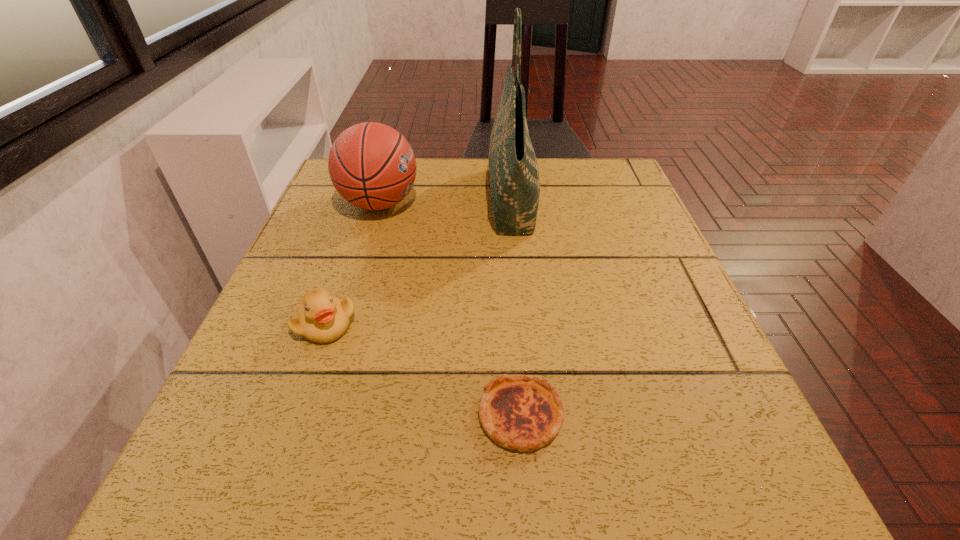
What are the coordinates of `vacant area at the near left corner` in the screenshot? It's located at (252, 518).

This screenshot has width=960, height=540. Find the location of `vacant area at the far right corner`. vacant area at the far right corner is located at coordinates (612, 176).

You are a GUI agent. You are given a task and a screenshot of the screen. Output one action in this format:
    pyautogui.click(x=<x>, y=<y>)
    Task: Click on the vacant space at the near right corner of the desktop
    The image size is (960, 540).
    Given the screenshot: What is the action you would take?
    pyautogui.click(x=693, y=484)

Where is `free space between the basketball and the tote bag`? free space between the basketball and the tote bag is located at coordinates (445, 202).

Identify the location of free space between the basketball and the nearest object. Image resolution: width=960 pixels, height=540 pixels. (450, 309).

At what (x,y) coordinates should I click in order to perform the action: click on blank region between the quiche and the basketball. Please return your answer as a coordinate pair (x, y). Looking at the image, I should click on (450, 309).

Locate an element on the screen. vacant point located between the basketball and the tallest object is located at coordinates (445, 202).

This screenshot has height=540, width=960. In order to click on free spot between the third shortest object and the tallest object in this screenshot , I will do [x=445, y=202].

Identify the location of free space between the nearest object and the second nearest object. (423, 369).

Where is `free space that is in between the shortest object and the basketball`? The height and width of the screenshot is (540, 960). free space that is in between the shortest object and the basketball is located at coordinates (450, 309).